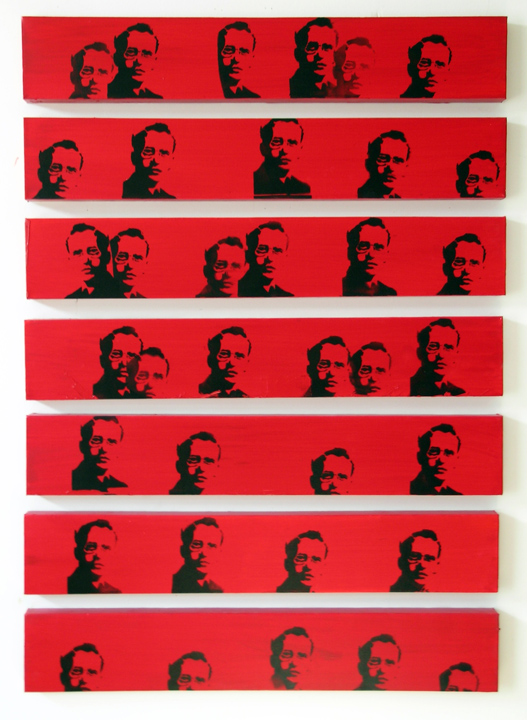
The image size is (527, 720). Identify the location of left edge of wooden slat. (25, 652), (23, 549), (25, 444), (25, 353), (25, 253), (25, 152), (22, 52).